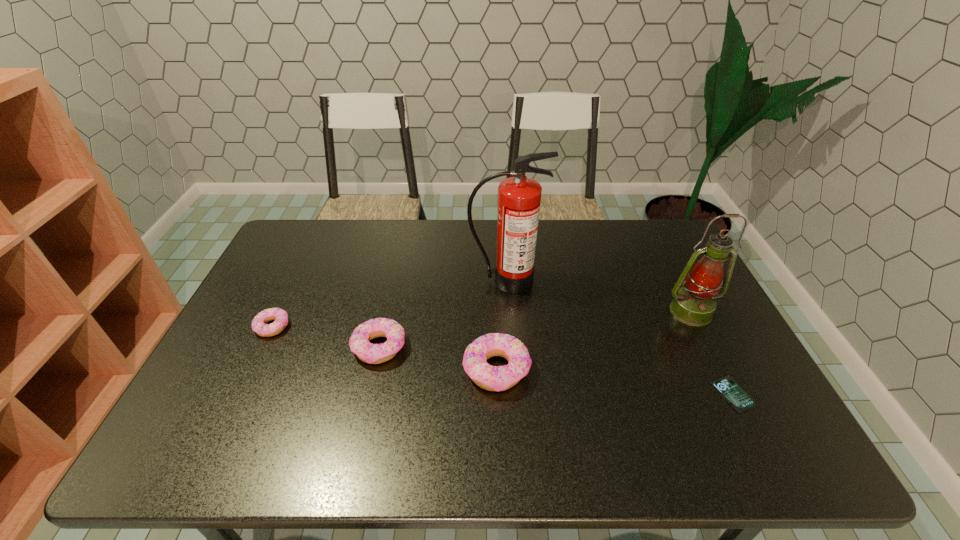
Find the location of `the second closest doughnut to the rightmost doughnut`. the second closest doughnut to the rightmost doughnut is located at coordinates (259, 325).

At what (x,y) coordinates should I click in order to perform the action: click on free space in the image that satisfies the following two spatial constraints: 1. on the front-facing side of the shortest object; 2. on the right side of the fire extinguisher. Please return your answer as a coordinate pair (x, y). The width and height of the screenshot is (960, 540). Looking at the image, I should click on (514, 394).

You are a GUI agent. You are given a task and a screenshot of the screen. Output one action in this format:
    pyautogui.click(x=<x>, y=<y>)
    Task: Click on the free space that satisfies the following two spatial constraints: 1. on the front side of the rightmost doughnut; 2. on the right side of the shortest object
    
    Given the screenshot: What is the action you would take?
    pyautogui.click(x=497, y=394)